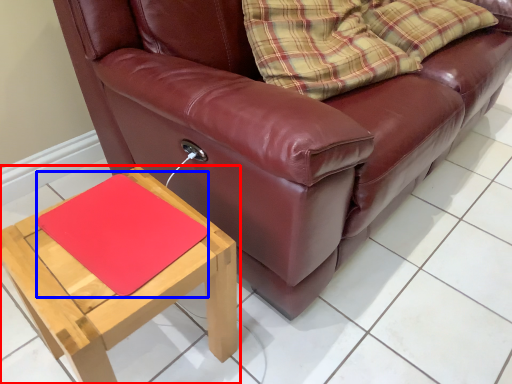
Question: Which object appears farthest to the camera in this image, table (highlighted by a red box) or mat (highlighted by a blue box)?

Choices:
 (A) table
 (B) mat

Answer: (B)